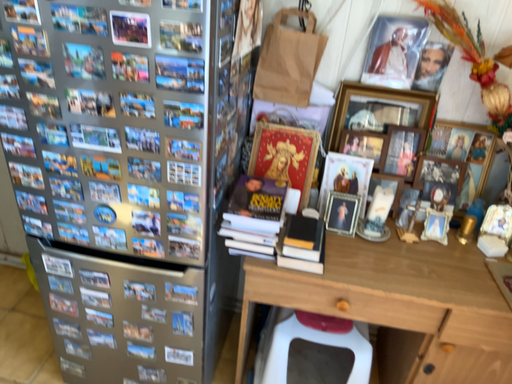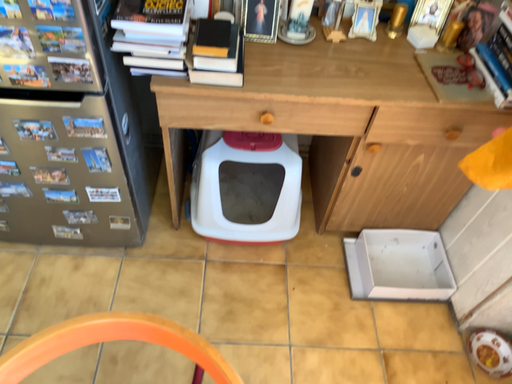
Question: Which way did the camera rotate in the video?

Choices:
 (A) rotated upward
 (B) rotated downward

Answer: (B)